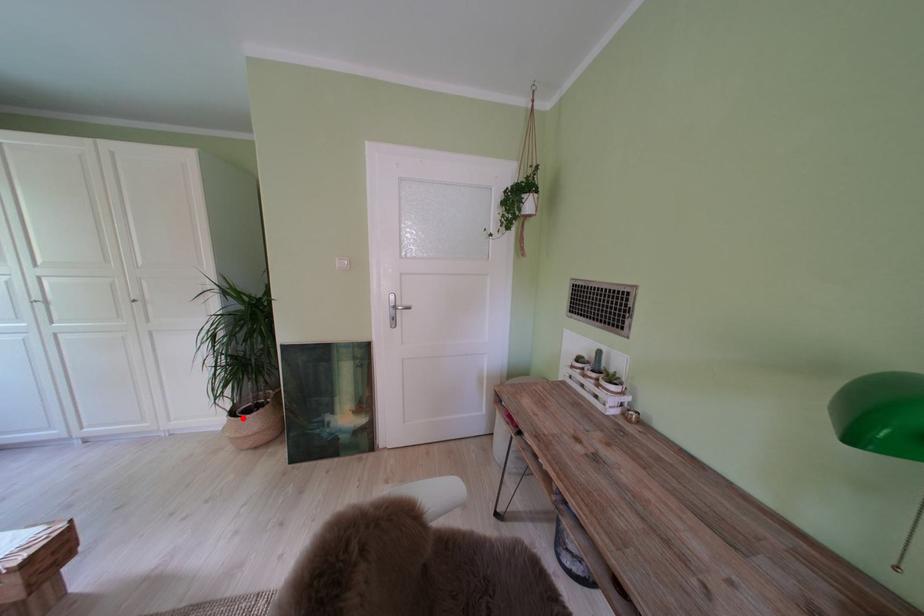
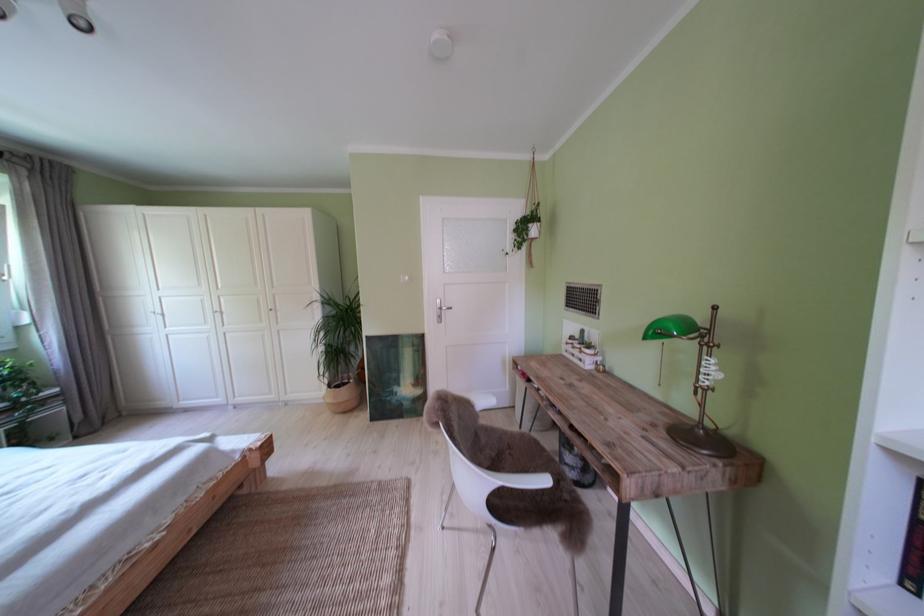
Where in the second image is the point corresponding to the highlighted location from the first image?

(341, 392)